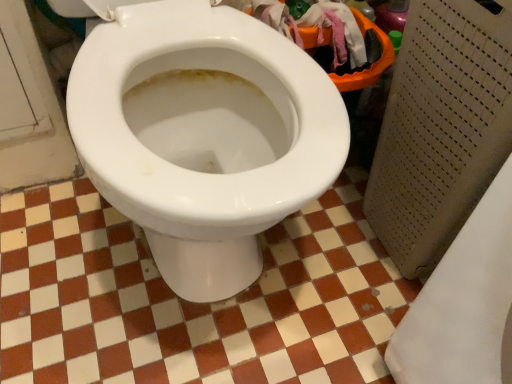
Describe the element at coordinates (204, 137) in the screenshot. I see `white glossy toilet at center` at that location.

Identify the location of white glossy toilet at center. coord(204,137).

Measure the distance between point (56, 222) and camera.

35.51 inches.

You are a GUI agent. You are given a task and a screenshot of the screen. Output one action in this format:
    pyautogui.click(x=<x>, y=<y>)
    Task: Click on the white glossy tile at center
    
    Given the screenshot: What is the action you would take?
    pyautogui.click(x=192, y=303)

Measure the distance between white glossy tile at center and camera.

white glossy tile at center and camera are 24.22 inches apart.

What do you see at coordinates (192, 303) in the screenshot?
I see `white glossy tile at center` at bounding box center [192, 303].

This screenshot has width=512, height=384. In order to click on white glossy toilet at center in this screenshot , I will do `click(204, 137)`.

Considering the positions of objects white glossy toilet at center and white glossy tile at center in the image provided, who is more to the right, white glossy toilet at center or white glossy tile at center?

white glossy tile at center.

Which is in front, white glossy toilet at center or white glossy tile at center?

white glossy toilet at center.

Which is behind, point (185, 190) or point (122, 368)?

The point (122, 368) is farther.

From the image's perspective, who appears lower, white glossy toilet at center or white glossy tile at center?

white glossy tile at center, from the image's perspective.

From a real-world perspective, does white glossy toilet at center sit lower than white glossy tile at center?

No, from a real-world perspective, white glossy toilet at center is not beneath white glossy tile at center.

Looking at this image, is white glossy toilet at center thinner than white glossy tile at center?

Indeed, white glossy toilet at center has a lesser width compared to white glossy tile at center.

Who is taller, white glossy toilet at center or white glossy tile at center?

white glossy toilet at center.

Considering the sizes of objects white glossy toilet at center and white glossy tile at center in the image provided, who is bigger, white glossy toilet at center or white glossy tile at center?

With larger size is white glossy toilet at center.

Would you say white glossy toilet at center is outside white glossy tile at center?

Yes, white glossy toilet at center is not within white glossy tile at center.

Is white glossy toilet at center far away from white glossy tile at center?

No, there isn't a large distance between white glossy toilet at center and white glossy tile at center.

Could you tell me if white glossy toilet at center is turned towards white glossy tile at center?

No, white glossy toilet at center is not facing towards white glossy tile at center.

Measure the distance between white glossy toilet at center and white glossy tile at center.

white glossy toilet at center is 9.68 inches away from white glossy tile at center.

At what (x,y) coordinates should I click in order to perform the action: click on ceramic tile below the white glossy toilet at center (from the image's perspective). Please return your answer as a coordinate pair (x, y). Looking at the image, I should click on (192, 303).

Considering the positions of objects white glossy tile at center and white glossy toilet at center in the image provided, who is more to the left, white glossy tile at center or white glossy toilet at center?

white glossy toilet at center.

Between white glossy tile at center and white glossy toilet at center, which one is positioned behind?

Positioned behind is white glossy tile at center.

Which point is more distant from viewer, (8, 270) or (276, 89)?

Point (8, 270)

In the scene shown: From the image's perspective, between white glossy tile at center and white glossy toilet at center, who is located below?

white glossy tile at center appears lower in the image.

From a real-world perspective, relative to white glossy toilet at center, is white glossy tile at center vertically above or below?

white glossy tile at center is below white glossy toilet at center.

Is white glossy tile at center wider or thinner than white glossy toilet at center?

Considering their sizes, white glossy tile at center looks broader than white glossy toilet at center.

Considering the sizes of objects white glossy tile at center and white glossy toilet at center in the image provided, who is taller, white glossy tile at center or white glossy toilet at center?

white glossy toilet at center.

Does white glossy tile at center have a smaller size compared to white glossy toilet at center?

Indeed, white glossy tile at center has a smaller size compared to white glossy toilet at center.

Is white glossy toilet at center inside white glossy tile at center?

No, white glossy toilet at center is located outside of white glossy tile at center.

Is white glossy tile at center directly adjacent to white glossy toilet at center?

No, white glossy tile at center is not with white glossy toilet at center.

Is white glossy tile at center looking in the opposite direction of white glossy toilet at center?

No, white glossy toilet at center is not at the back of white glossy tile at center.

How many degrees apart are the facing directions of white glossy tile at center and white glossy toilet at center?

The angle between the facing direction of white glossy tile at center and the facing direction of white glossy toilet at center is 0.986 degrees.

Find the location of a particular element. This screenshot has width=512, height=384. ceramic tile below the white glossy toilet at center (from the image's perspective) is located at coordinates (192, 303).

The width and height of the screenshot is (512, 384). I want to click on toilet located above the white glossy tile at center (from the image's perspective), so click(x=204, y=137).

At what (x,y) coordinates should I click in order to perform the action: click on ceramic tile behind the white glossy toilet at center. Please return your answer as a coordinate pair (x, y). The width and height of the screenshot is (512, 384). Looking at the image, I should click on (192, 303).